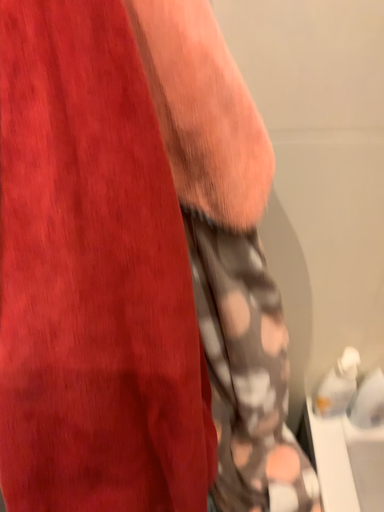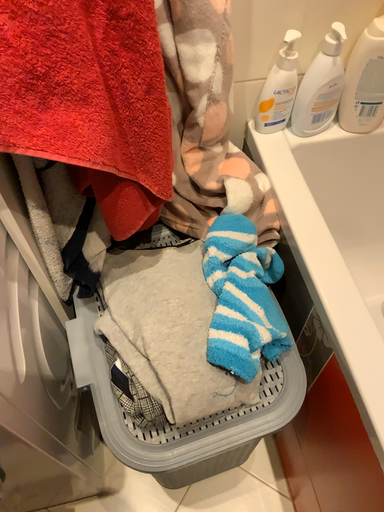
Question: Which way did the camera rotate in the video?

Choices:
 (A) rotated right
 (B) rotated left

Answer: (A)